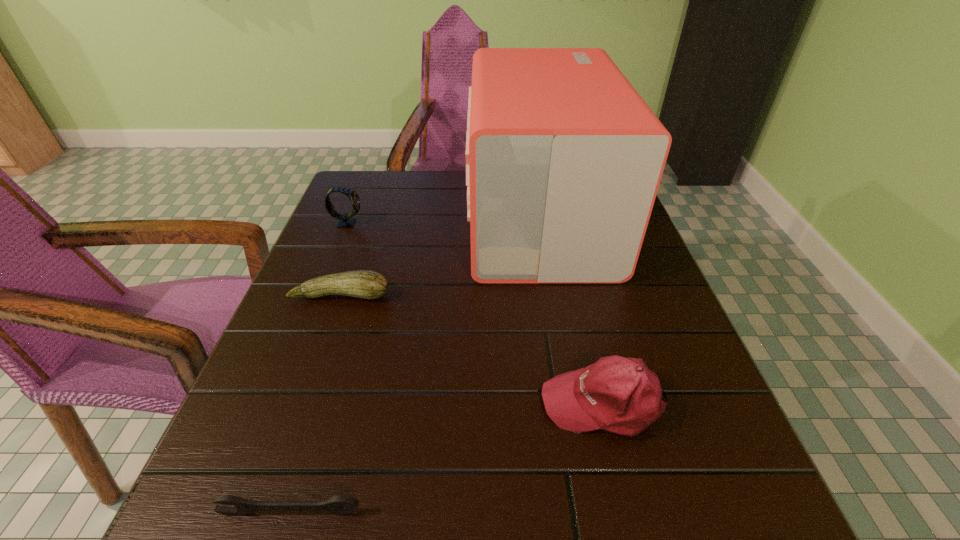
At what (x,y) coordinates should I click in order to perform the action: click on box. Please return your answer as a coordinate pair (x, y). Looking at the image, I should click on (564, 158).

The width and height of the screenshot is (960, 540). Identify the location of watch. (345, 221).

I want to click on the fourth farthest object, so click(621, 395).

At what (x,y) coordinates should I click in order to perform the action: click on the third farthest object. Please return your answer as a coordinate pair (x, y). This screenshot has height=540, width=960. Looking at the image, I should click on (365, 284).

Identify the location of zucchini. (365, 284).

Where is `wrench`? This screenshot has width=960, height=540. wrench is located at coordinates (339, 505).

Where is `the shortest object`? the shortest object is located at coordinates (339, 505).

This screenshot has height=540, width=960. I want to click on vacant space situated 0.090m on the surface of the tallest object where the text is embossed, so click(x=434, y=218).

You are a GUI agent. You are given a task and a screenshot of the screen. Output one action in this format:
    pyautogui.click(x=<x>, y=<y>)
    Task: Click on the vacant position located 0.160m on the surface of the tallest object where the text is embossed
    The height and width of the screenshot is (540, 960).
    Given the screenshot: What is the action you would take?
    pyautogui.click(x=407, y=218)

The image size is (960, 540). Find the location of `vacant space located on the surface of the tallest object where the text is embossed`. vacant space located on the surface of the tallest object where the text is embossed is located at coordinates (430, 218).